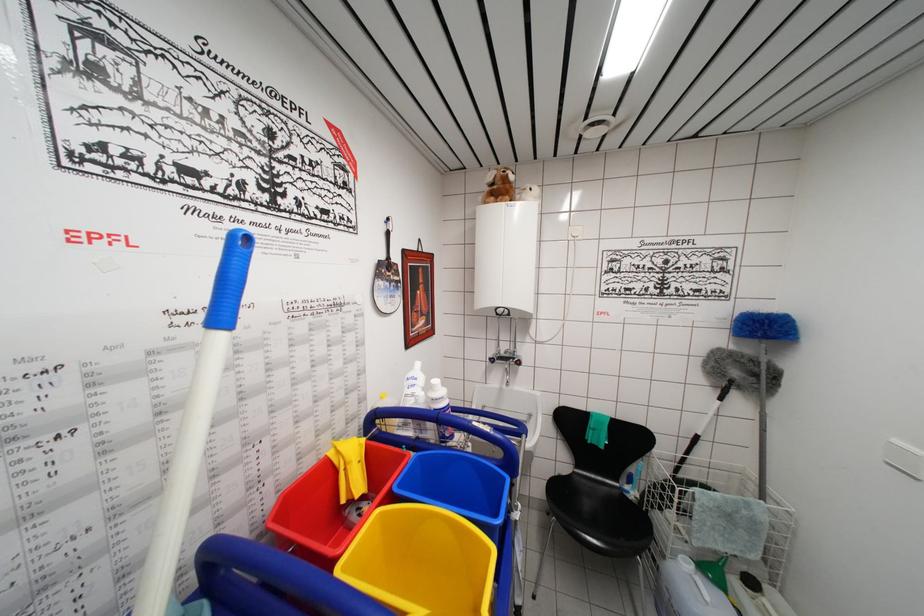
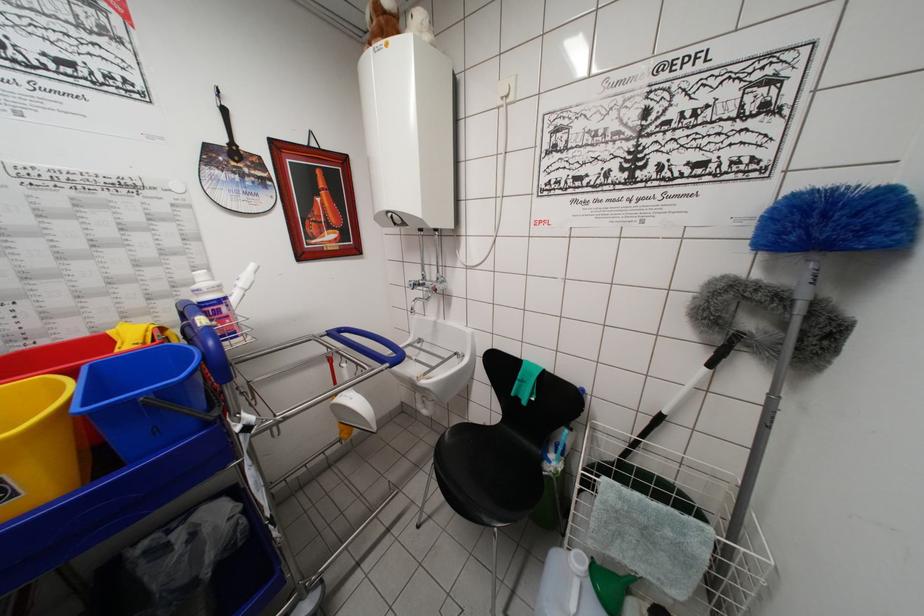
Question: I am providing you with two images of the same scene from different viewpoints. After the viewpoint changes to image2, which objects are now occluded?

Choices:
 (A) white cleaner bottle
 (B) green funnel
 (C) stuffed animal toy
 (D) none of these

Answer: (D)